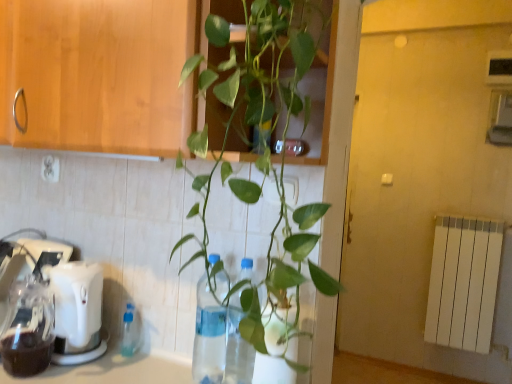
Question: Would you say clear plastic bottle at center, which appears as the second bottle when viewed from the left, is inside or outside transparent plastic bottle at lower left, positioned as the 2th bottle in front-to-back order?

Choices:
 (A) inside
 (B) outside

Answer: (B)

Question: Considering the positions of clear plastic bottle at center, the 1th bottle from the right, and transparent plastic bottle at lower left, the first bottle in the back-to-front sequence, in the image, is clear plastic bottle at center, the 1th bottle from the right, taller or shorter than transparent plastic bottle at lower left, the first bottle in the back-to-front sequence,?

Choices:
 (A) tall
 (B) short

Answer: (A)

Question: Which is nearer to the transparent plastic bottle at center?

Choices:
 (A) transparent plastic bottle at lower left, positioned as the 2th bottle in front-to-back order
 (B) clear plastic bottle at center, the 1th bottle from the right
 (C) white plastic electric outlet at upper left
 (D) white plastic coffee machine at lower left
 (E) white plastic mixer at lower left

Answer: (B)

Question: Based on their relative distances, which object is farther from the clear plastic bottle at center, the 1th bottle from the right?

Choices:
 (A) white plastic coffee machine at lower left
 (B) transparent plastic bottle at center
 (C) white plastic electric outlet at upper left
 (D) white plastic mixer at lower left
 (E) transparent plastic bottle at lower left, the 1th bottle when ordered from left to right

Answer: (C)